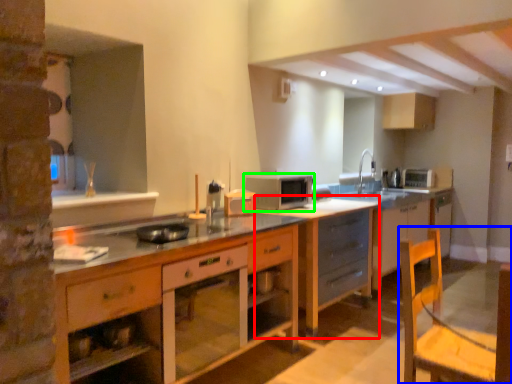
Question: Based on their relative distances, which object is nearer to cabinetry (highlighted by a red box)? Choose from swivel chair (highlighted by a blue box) and microwave oven (highlighted by a green box).

Choices:
 (A) swivel chair
 (B) microwave oven

Answer: (B)